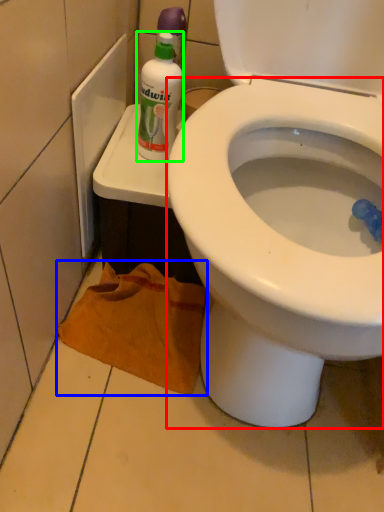
Question: Which object is the closest to the bidet (highlighted by a red box)? Choose among these: material (highlighted by a blue box) or cleaning product (highlighted by a green box).

Choices:
 (A) material
 (B) cleaning product

Answer: (A)